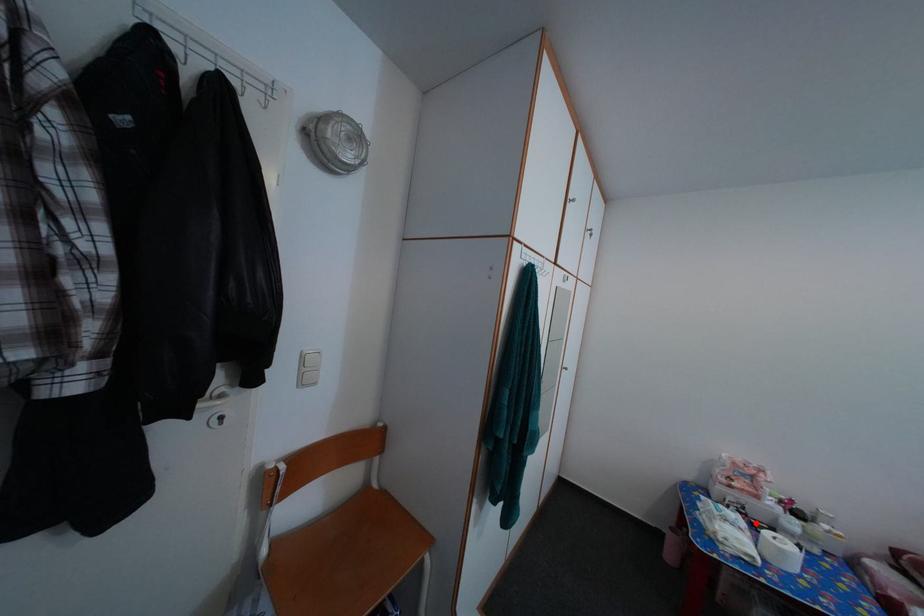
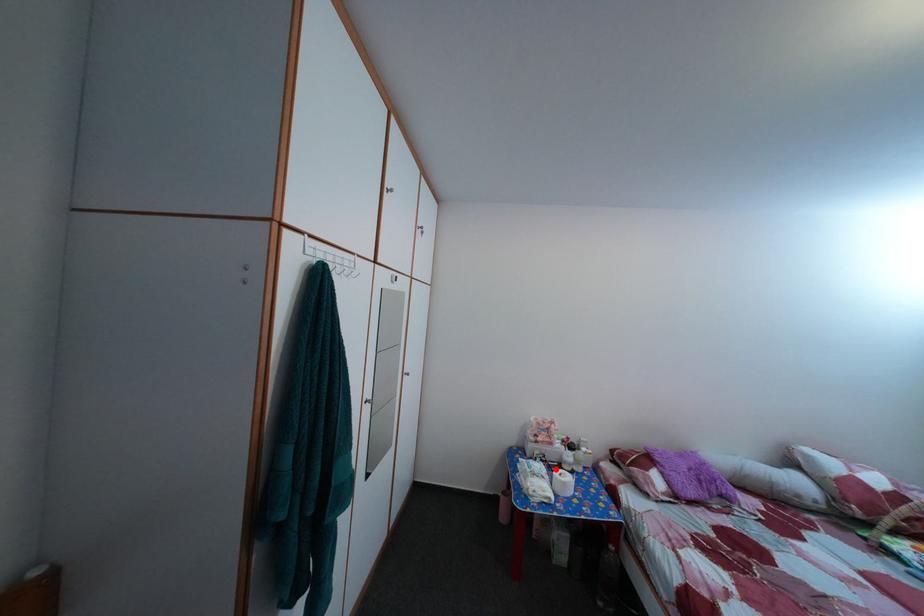
I am providing you with two images of the same scene from different viewpoints. A red point is marked on the first image and another point is marked on the second image. Is the red point in image1 aligned with the point shown in image2?

Yes